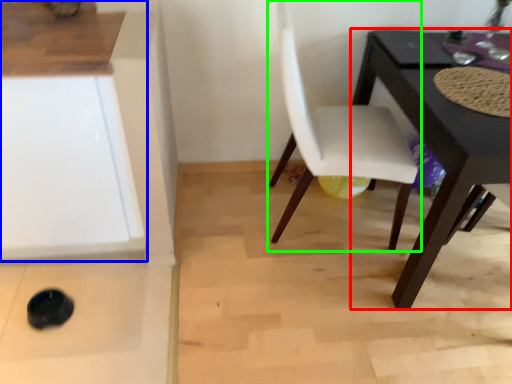
Question: Estimate the real-world distances between objects in this image. Which object is closer to table (highlighted by a red box), cabinetry (highlighted by a blue box) or chair (highlighted by a green box)?

Choices:
 (A) cabinetry
 (B) chair

Answer: (B)